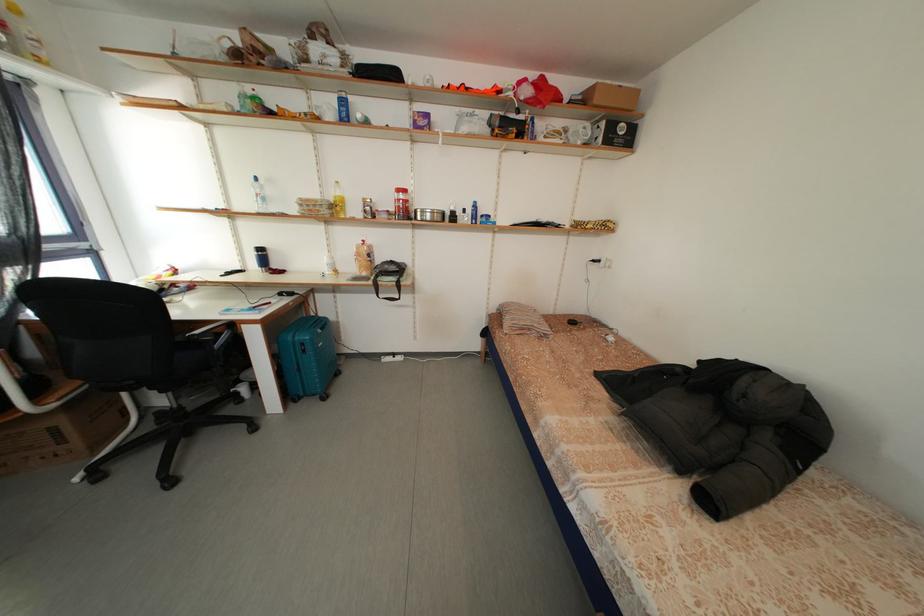
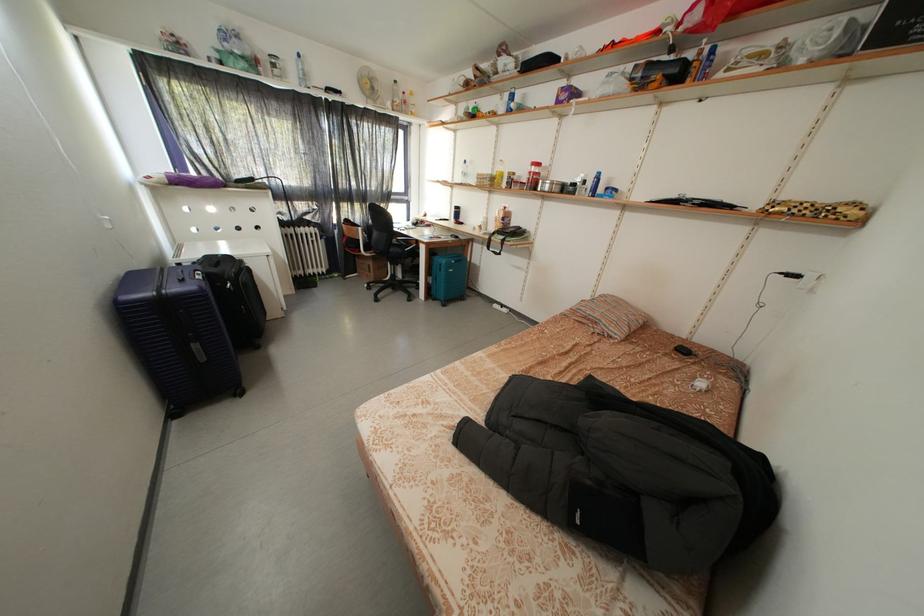
Find the pixel in the second image that matches (580,328) in the first image.

(691, 355)